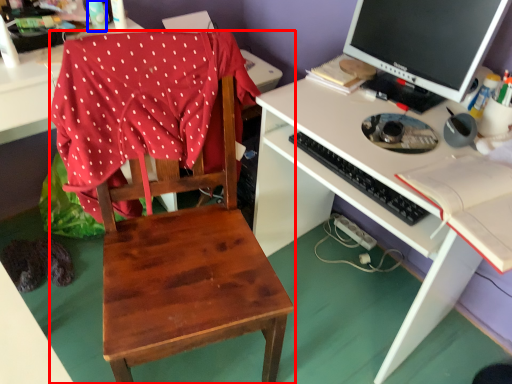
Question: Which of the following is the farthest to the observer, chair (highlighted by a red box) or bottle (highlighted by a blue box)?

Choices:
 (A) chair
 (B) bottle

Answer: (B)